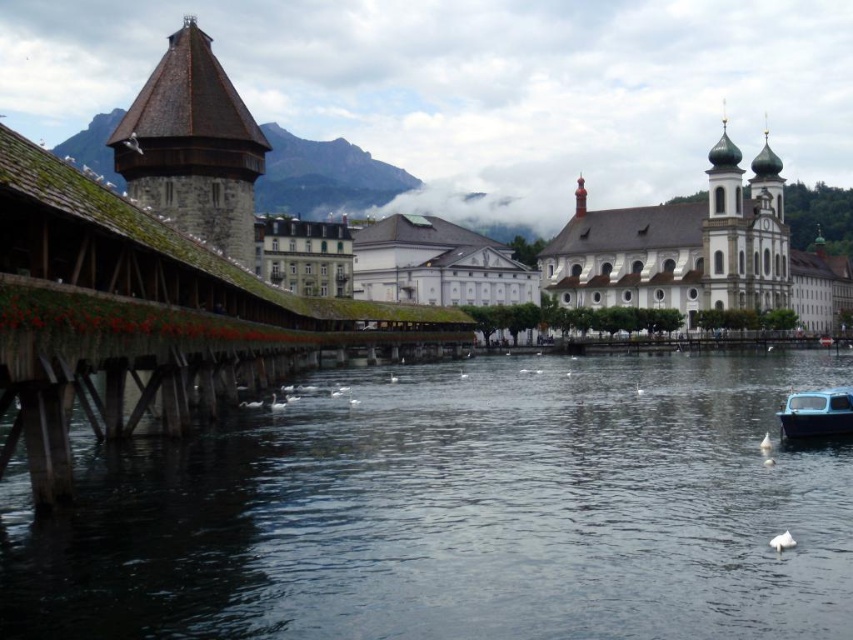
Can you confirm if white stone church at upper right is positioned to the left of blue matte boat at lower right?

Incorrect, white stone church at upper right is not on the left side of blue matte boat at lower right.

Does point (779, 262) come closer to viewer compared to point (817, 417)?

No, it is behind (817, 417).

Which is in front, point (775, 227) or point (828, 417)?

Point (828, 417) is in front.

Where is `white stone church at upper right`? This screenshot has width=853, height=640. white stone church at upper right is located at coordinates (744, 230).

Based on the photo, does brown stone tower at upper left appear under white stone church at upper right?

No.

Who is taller, brown stone tower at upper left or white stone church at upper right?

With more height is white stone church at upper right.

Who is more forward, (183, 67) or (718, 156)?

Point (183, 67) is in front.

This screenshot has height=640, width=853. Find the location of `brown stone tower at upper left`. brown stone tower at upper left is located at coordinates (193, 147).

Is brown stone tower at upper left above blue matte boat at lower right?

Correct, brown stone tower at upper left is located above blue matte boat at lower right.

How far apart are brown stone tower at upper left and blue matte boat at lower right?

62.79 meters

Find the location of `brown stone tower at upper left`. brown stone tower at upper left is located at coordinates (193, 147).